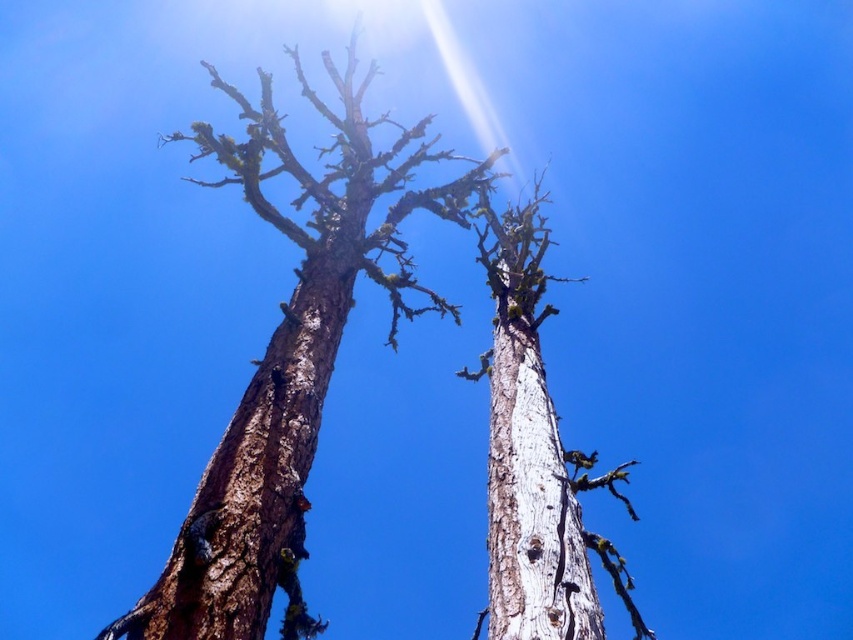
Question: Which point appears closest to the camera in this image?

Choices:
 (A) (299, 589)
 (B) (248, 480)

Answer: (B)

Question: Does brown rough bark tree at center have a smaller size compared to brown rough bark tree trunk at center?

Choices:
 (A) no
 (B) yes

Answer: (A)

Question: Does brown rough bark tree at center appear over brown rough bark tree trunk at center?

Choices:
 (A) no
 (B) yes

Answer: (B)

Question: Which of the following is the farthest from the observer?

Choices:
 (A) brown rough bark tree trunk at center
 (B) brown rough bark tree at center
 (C) white rough bark tree trunk at center

Answer: (C)

Question: Which object is the closest to the brown rough bark tree trunk at center?

Choices:
 (A) white rough bark tree trunk at center
 (B) brown rough bark tree at center

Answer: (A)

Question: Is brown rough bark tree trunk at center thinner than white rough bark tree trunk at center?

Choices:
 (A) no
 (B) yes

Answer: (A)